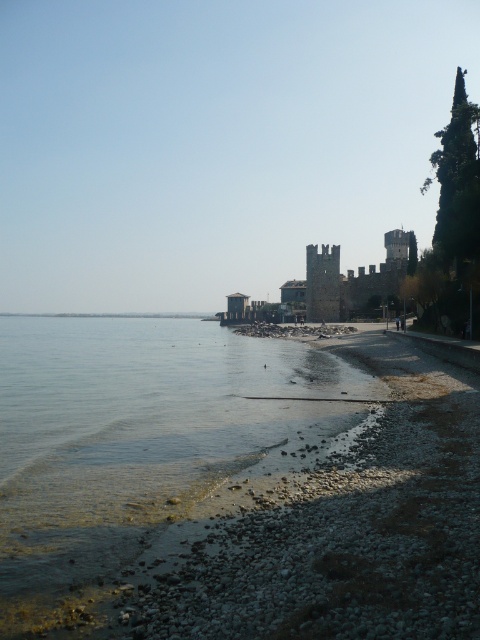
Does clear water at lower left have a greater height compared to dark stone castle at center?

No, clear water at lower left is not taller than dark stone castle at center.

Is point (177, 368) behind point (408, 250)?

No.

Where is `clear water at lower left`? This screenshot has height=640, width=480. clear water at lower left is located at coordinates (143, 445).